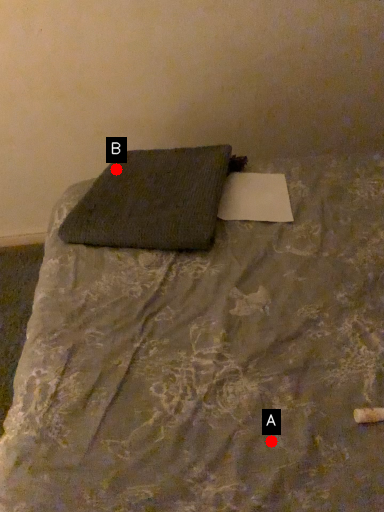
Question: Two points are circled on the image, labeled by A and B beside each circle. Which of the following is the closest to the observer?

Choices:
 (A) A is closer
 (B) B is closer

Answer: (A)